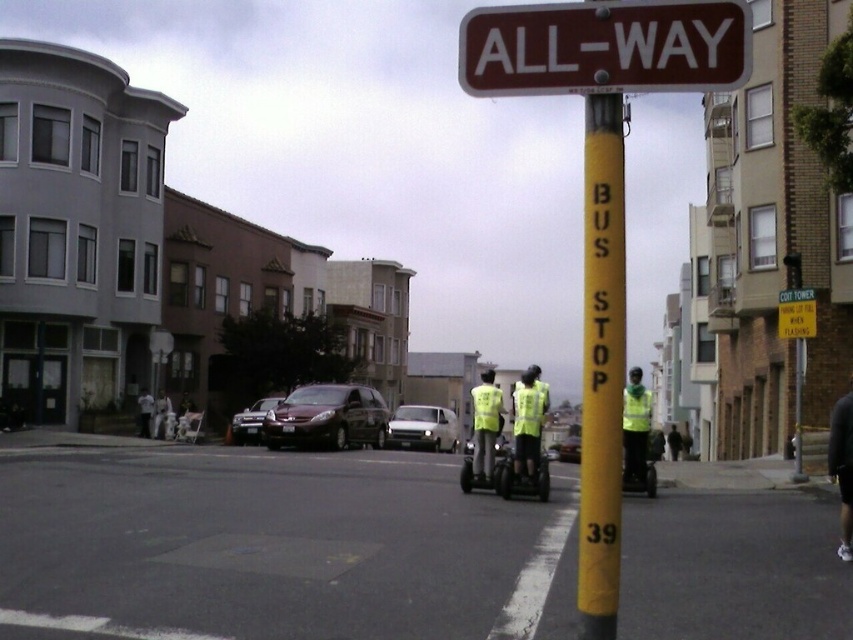
You are a pedestrian standing on the urban street scene described. You notice a reflective yellow safety vest at center and a metallic silver sedan at center. Which object is shorter in height?

The reflective yellow safety vest at center is not as tall as the metallic silver sedan at center, so the reflective yellow safety vest at center is shorter.

You are a pedestrian standing on the sidewalk and need to cross the street. There is a reflective yellow safety vest at center and a metallic silver sedan at center. Which object is narrower so you can safely walk around it?

The reflective yellow safety vest at center is narrower than the metallic silver sedan at center, so you can safely walk around it.